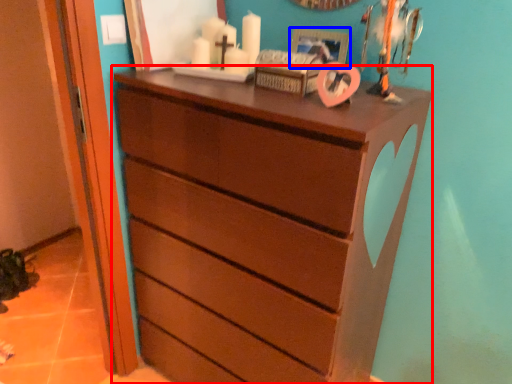
Question: Which object appears farthest to the camera in this image, chest of drawers (highlighted by a red box) or picture frame (highlighted by a blue box)?

Choices:
 (A) chest of drawers
 (B) picture frame

Answer: (B)